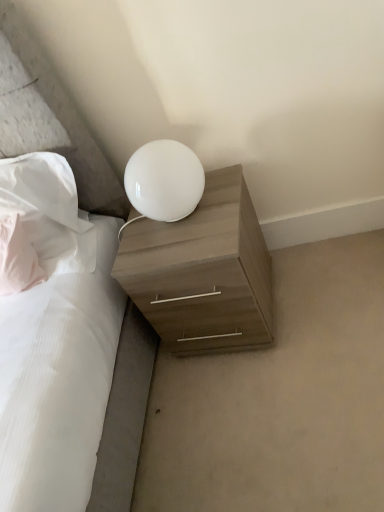
I want to click on space that is in front of white glossy lamp at upper center, so click(x=194, y=241).